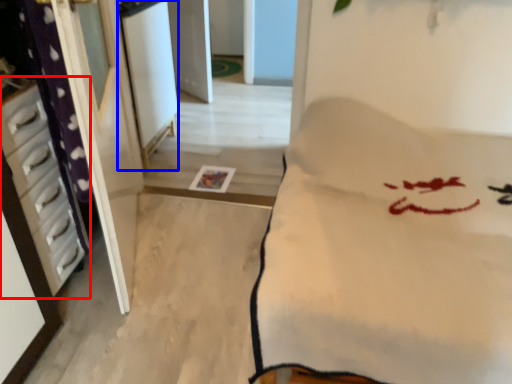
Question: Which of the following is the farthest to the observer, furniture (highlighted by a red box) or screen door (highlighted by a blue box)?

Choices:
 (A) furniture
 (B) screen door

Answer: (B)